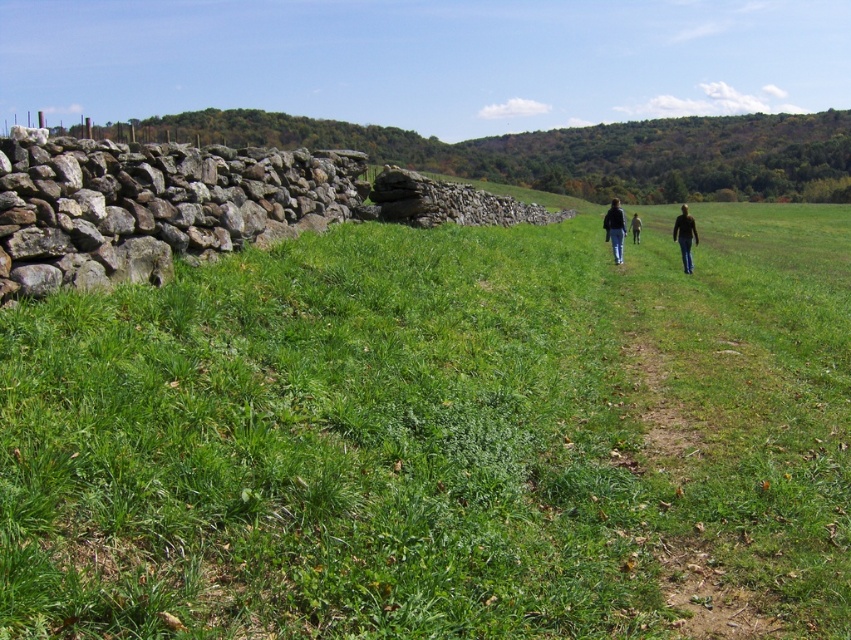
Question: Can you confirm if dark blue jeans at center is smaller than light brown leather jacket at center?

Choices:
 (A) yes
 (B) no

Answer: (B)

Question: Observing the image, what is the correct spatial positioning of dark brown leather jacket at center in reference to light brown leather jacket at center?

Choices:
 (A) below
 (B) above

Answer: (B)

Question: Among these points, which one is nearest to the camera?

Choices:
 (A) pyautogui.click(x=690, y=272)
 (B) pyautogui.click(x=393, y=554)

Answer: (B)

Question: Estimate the real-world distances between objects in this image. Which object is farther from the dark brown leather jacket at center-right?

Choices:
 (A) dark blue jeans at center
 (B) green grassy at left
 (C) dark brown leather jacket at center

Answer: (B)

Question: Can you confirm if dark brown leather jacket at center is wider than light brown leather jacket at center?

Choices:
 (A) no
 (B) yes

Answer: (B)

Question: Among these points, which one is farthest from the camera?

Choices:
 (A) (687, 259)
 (B) (625, 221)
 (C) (700, 310)
 (D) (680, 248)

Answer: (D)